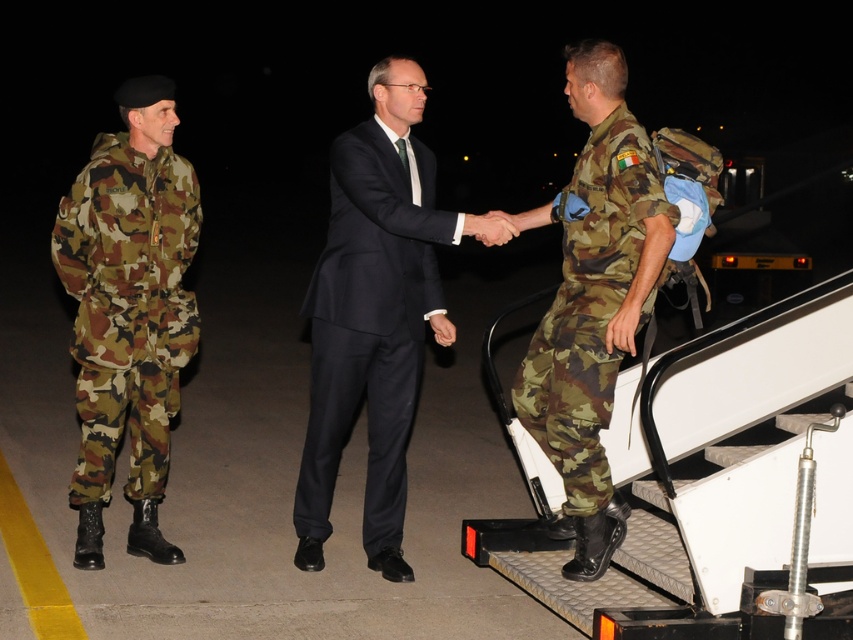
Between dark blue suit at center and camo fabric uniform at left, which one appears on the right side from the viewer's perspective?

From the viewer's perspective, dark blue suit at center appears more on the right side.

The height and width of the screenshot is (640, 853). Identify the location of dark blue suit at center. (375, 314).

Is dark blue suit at center wider than camo fabric uniform at right?

Yes.

Locate an element on the screen. Image resolution: width=853 pixels, height=640 pixels. dark blue suit at center is located at coordinates (375, 314).

Can you confirm if camo fabric uniform at left is positioned to the right of camo fabric uniform at right?

Incorrect, camo fabric uniform at left is not on the right side of camo fabric uniform at right.

Can you confirm if camo fabric uniform at left is positioned to the left of camo fabric uniform at right?

Indeed, camo fabric uniform at left is positioned on the left side of camo fabric uniform at right.

Is point (131, 228) farther from viewer compared to point (631, 250)?

Yes.

Find the location of a particular element. This screenshot has height=640, width=853. camo fabric uniform at left is located at coordinates (126, 307).